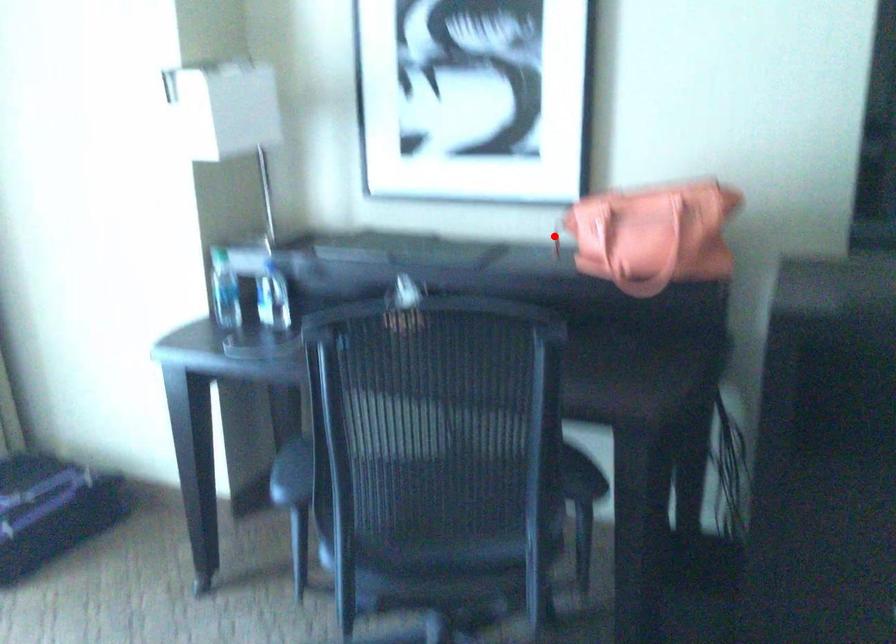
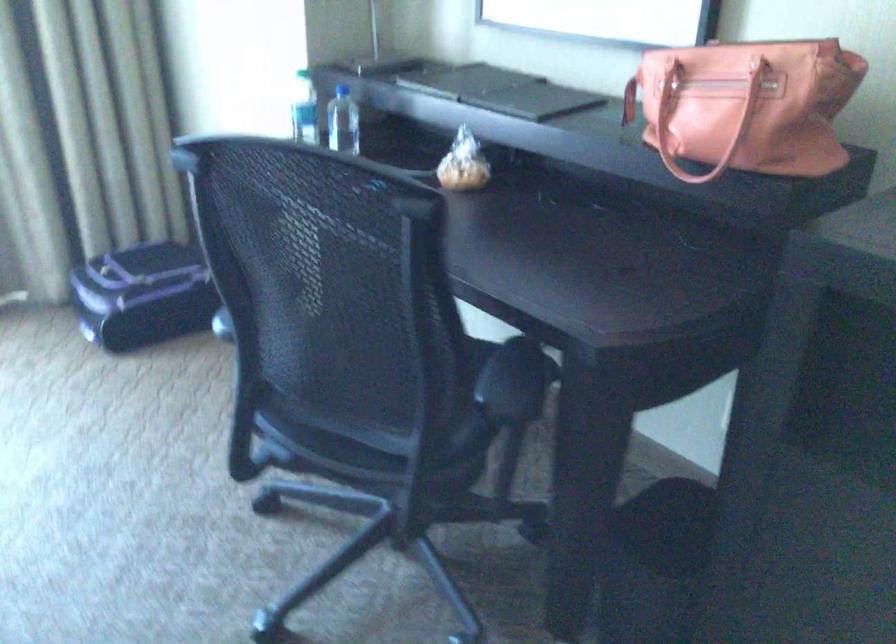
Question: I am providing you with two images of the same scene from different viewpoints. Given a red point in image1, look at the same physical point in image2. Is it:

Choices:
 (A) Closer to the viewpoint
 (B) Farther from the viewpoint

Answer: (A)